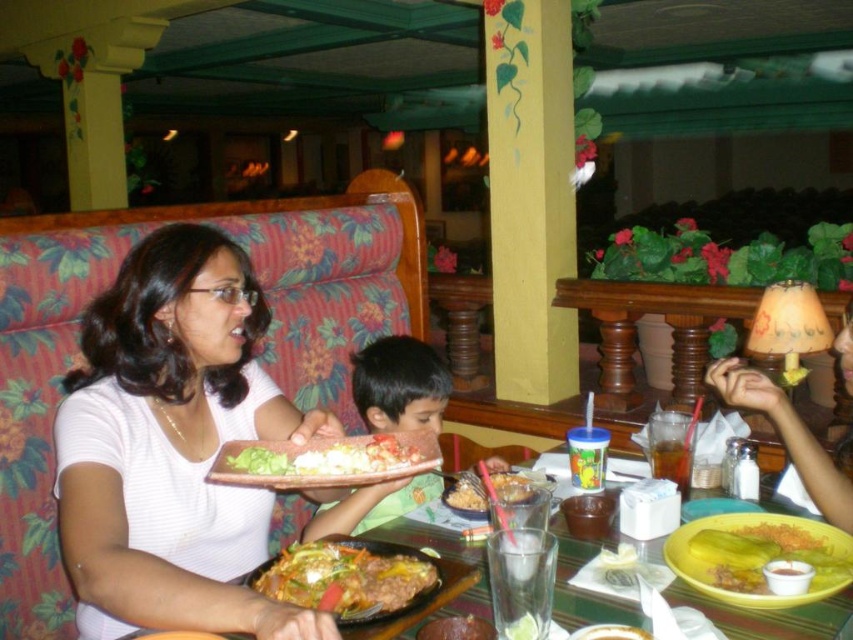
You are a waiter in a restaurant and you see a customer wearing a white matte shirt at center and a yellow matte plate at lower right. Which object is closer to the left side of the scene?

The white matte shirt at center is closer to the left side of the scene because it is positioned to the left of the yellow matte plate at lower right.

You are a waiter in a restaurant and you see a customer holding a matte white shirt at center and a shiny plastic tray at center. Which object is closer to the floor?

The matte white shirt at center is closer to the floor because it is located below the shiny plastic tray at center.